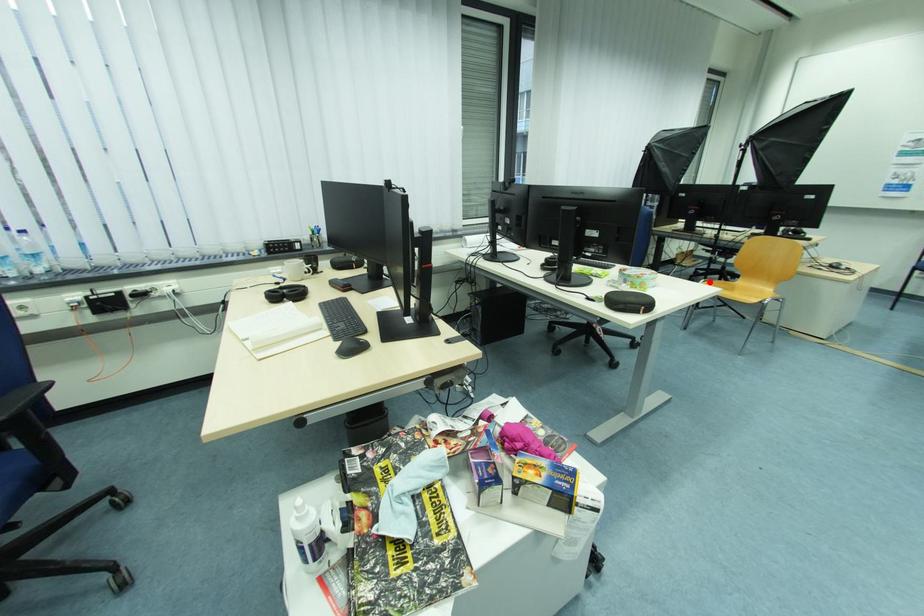
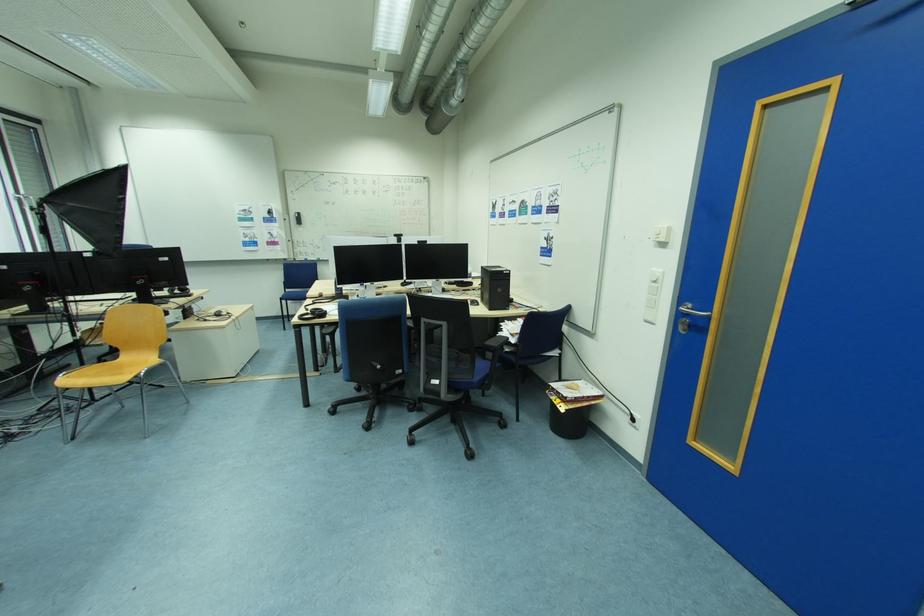
Where in the second image is the point corresponding to the highlighted location from the first image?

(68, 377)